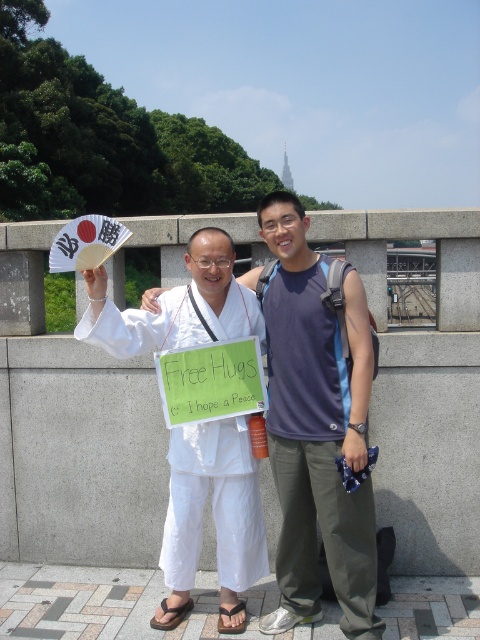
Which of these two, white cotton kimono at center or matte gray tank top at center, stands taller?

With more height is white cotton kimono at center.

Can you confirm if white cotton kimono at center is positioned to the left of matte gray tank top at center?

Correct, you'll find white cotton kimono at center to the left of matte gray tank top at center.

Is point (191, 304) closer to camera compared to point (350, 467)?

No, it is not.

Identify the location of white cotton kimono at center. (317, 426).